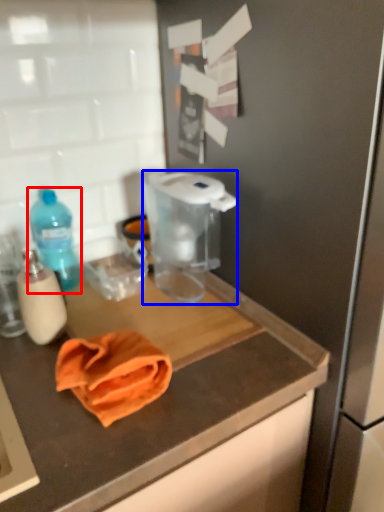
Question: Which point is closer to the camera, bottle (highlighted by a red box) or appliance (highlighted by a blue box)?

Choices:
 (A) bottle
 (B) appliance

Answer: (B)